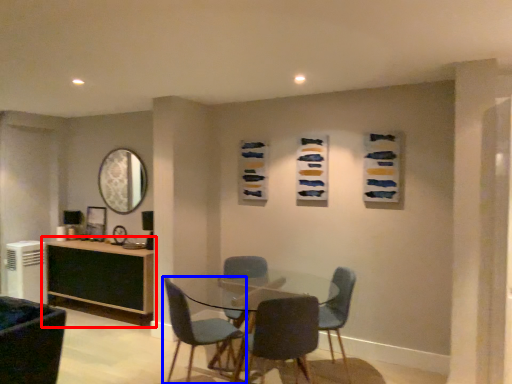
Question: Among these objects, which one is nearest to the camera, desk (highlighted by a red box) or chair (highlighted by a blue box)?

Choices:
 (A) desk
 (B) chair

Answer: (B)